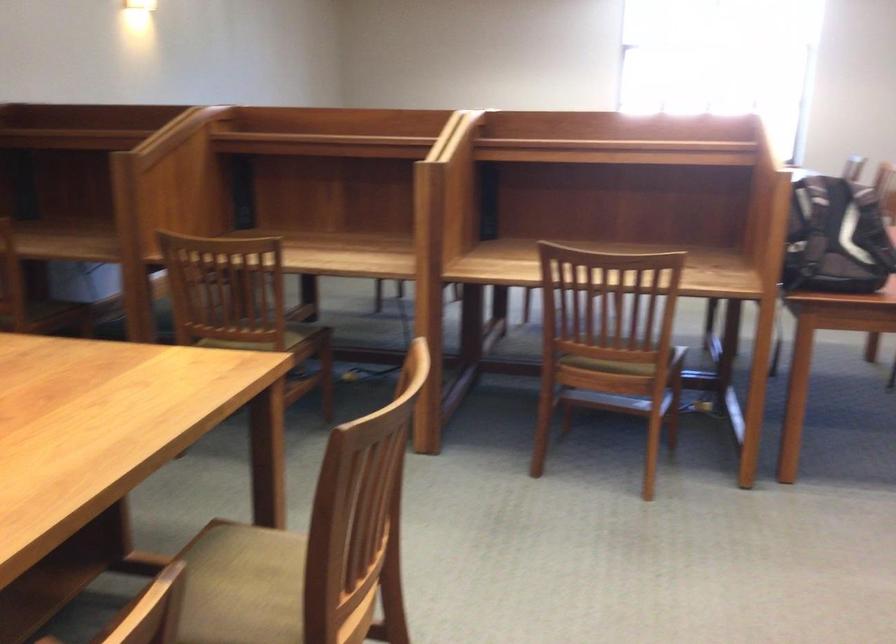
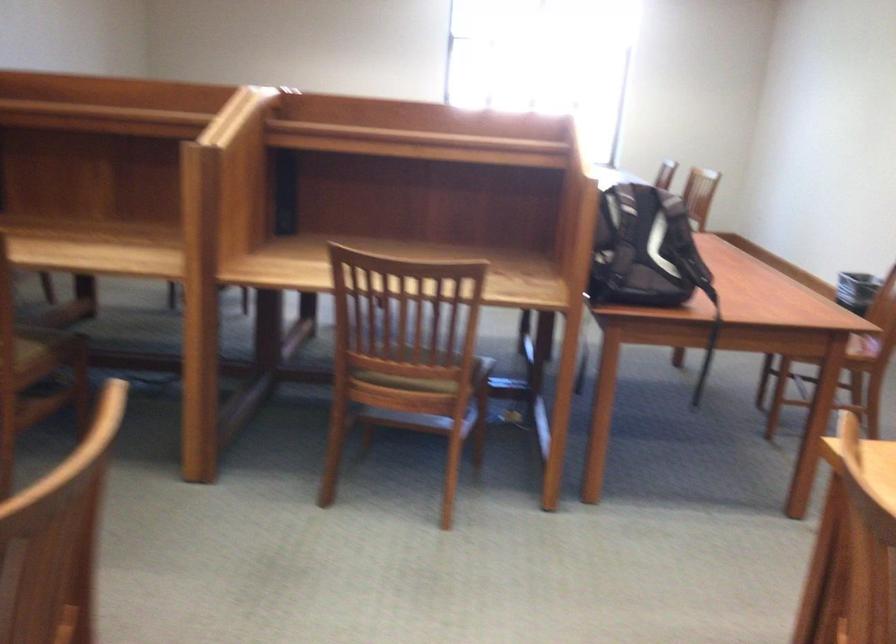
Find the pixel in the second image that matches (306,343) in the first image.

(46, 348)